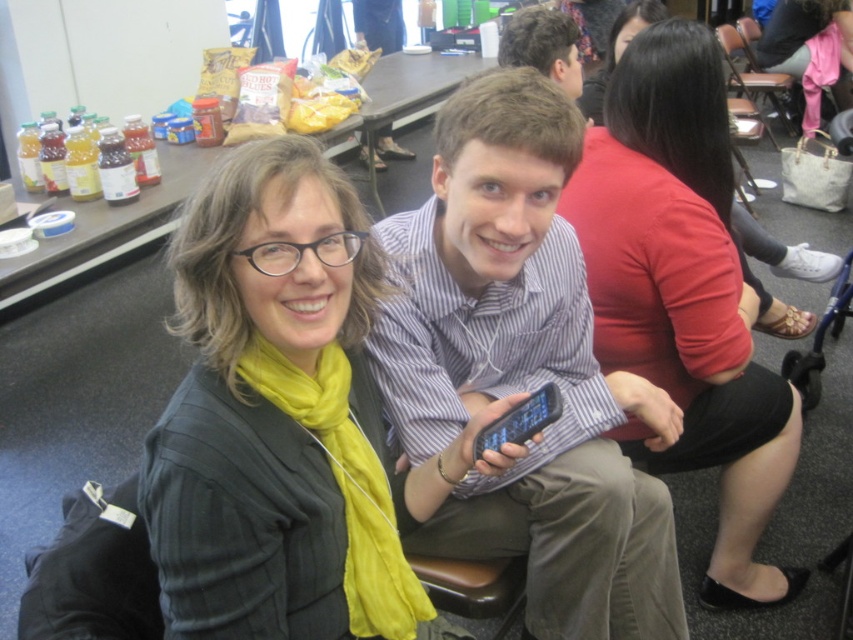
Can you confirm if matte red blouse at center is wider than pink fabric at upper right?

Correct, the width of matte red blouse at center exceeds that of pink fabric at upper right.

Where is `matte red blouse at center`? Image resolution: width=853 pixels, height=640 pixels. matte red blouse at center is located at coordinates (683, 294).

This screenshot has width=853, height=640. In order to click on matte red blouse at center in this screenshot , I will do `click(683, 294)`.

Can you confirm if matte black blazer at center is positioned to the left of brown leather chair at upper right?

Yes, matte black blazer at center is to the left of brown leather chair at upper right.

Can you confirm if matte black blazer at center is positioned to the right of brown leather chair at upper right?

Incorrect, matte black blazer at center is not on the right side of brown leather chair at upper right.

Between point (277, 269) and point (784, 74), which one is positioned behind?

The point (784, 74) is more distant.

Locate an element on the screen. matte black blazer at center is located at coordinates (277, 419).

Is point (225, 266) in front of point (596, 97)?

Yes, point (225, 266) is in front of point (596, 97).

This screenshot has width=853, height=640. Find the location of `matte black blazer at center`. matte black blazer at center is located at coordinates (277, 419).

Which is in front, point (314, 285) or point (642, 19)?

Point (314, 285) is more forward.

The image size is (853, 640). I want to click on matte black blazer at center, so click(x=277, y=419).